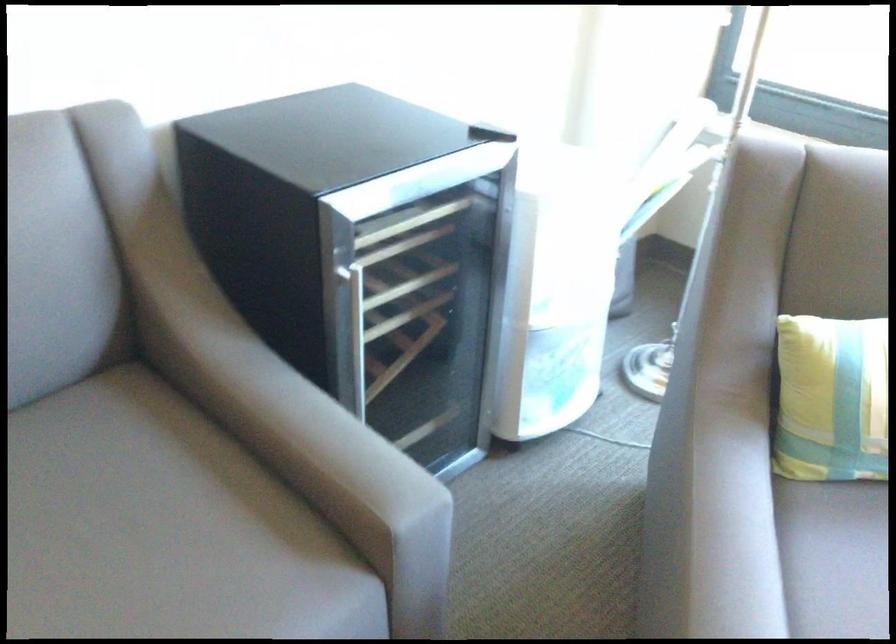
Which object does [831,399] point to?

It refers to a striped small pillow.